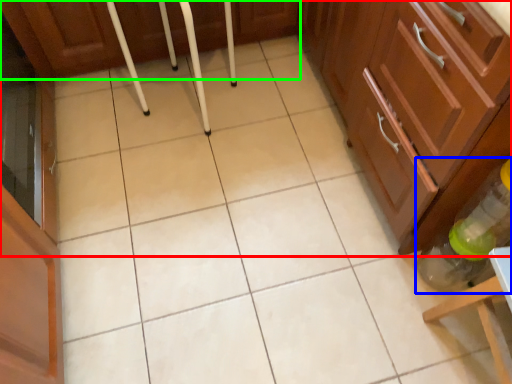
Question: Based on their relative distances, which object is nearer to cabinetry (highlighted by a red box)? Choose from bottle (highlighted by a blue box) and cabinetry (highlighted by a green box).

Choices:
 (A) bottle
 (B) cabinetry

Answer: (A)